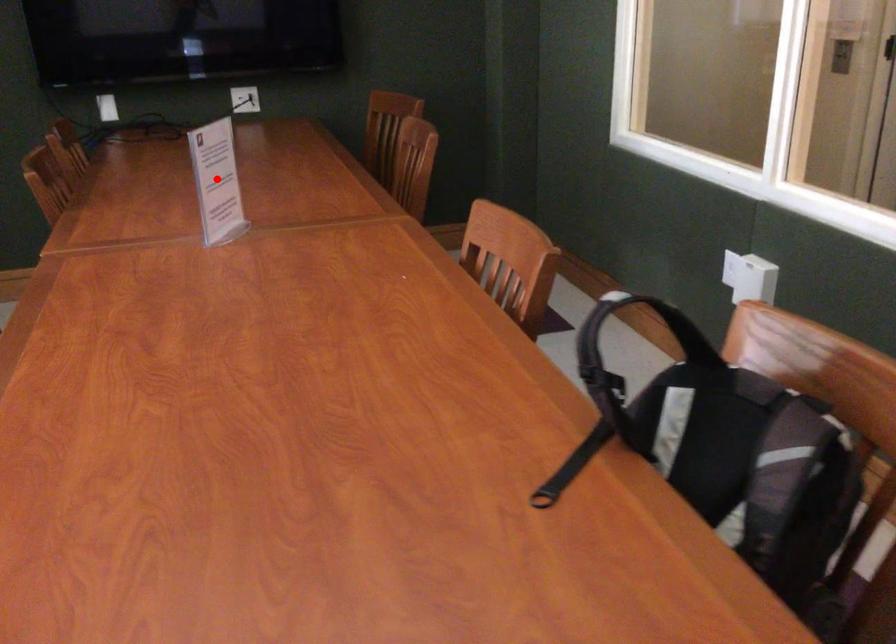
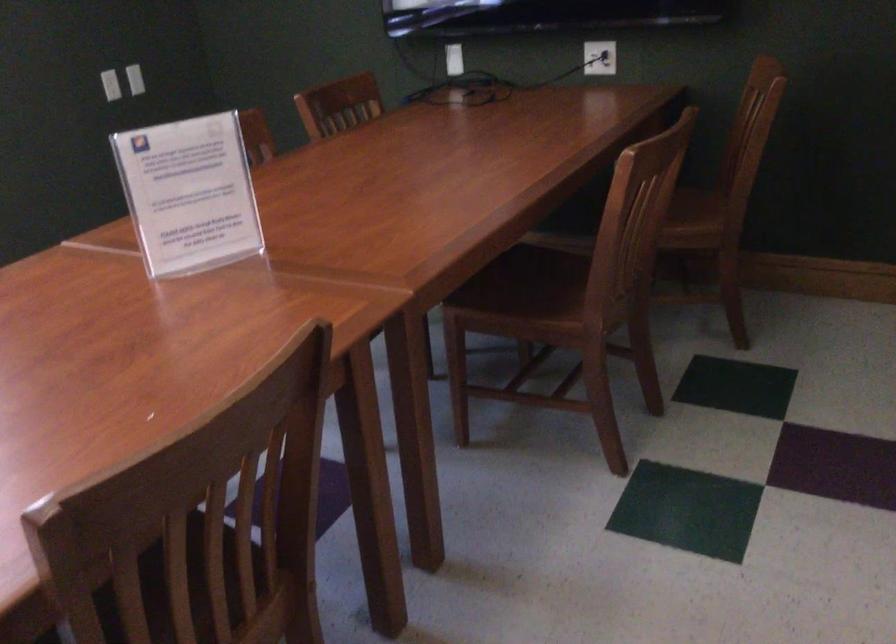
In the second image, find the point that corresponds to the highlighted location in the first image.

(188, 194)